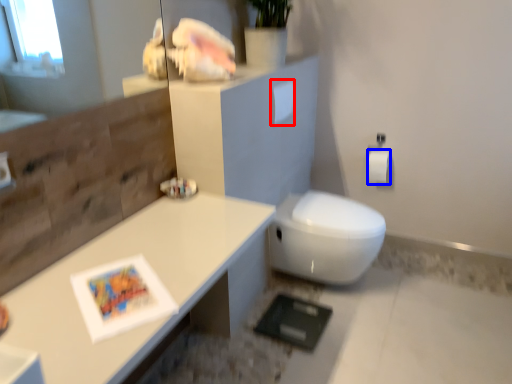
Question: Which of the following is the closest to the observer, toilet paper (highlighted by a red box) or toilet paper (highlighted by a blue box)?

Choices:
 (A) toilet paper
 (B) toilet paper

Answer: (A)